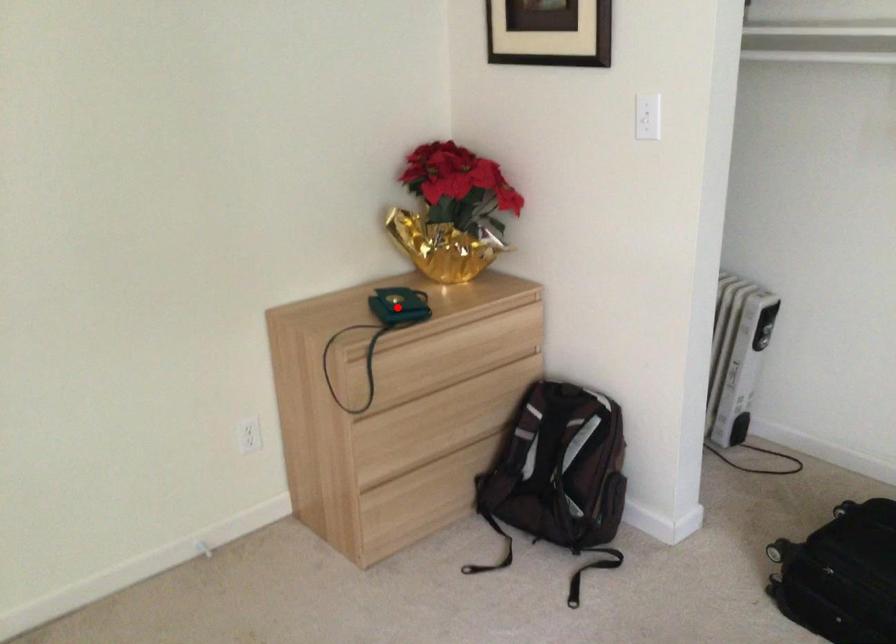
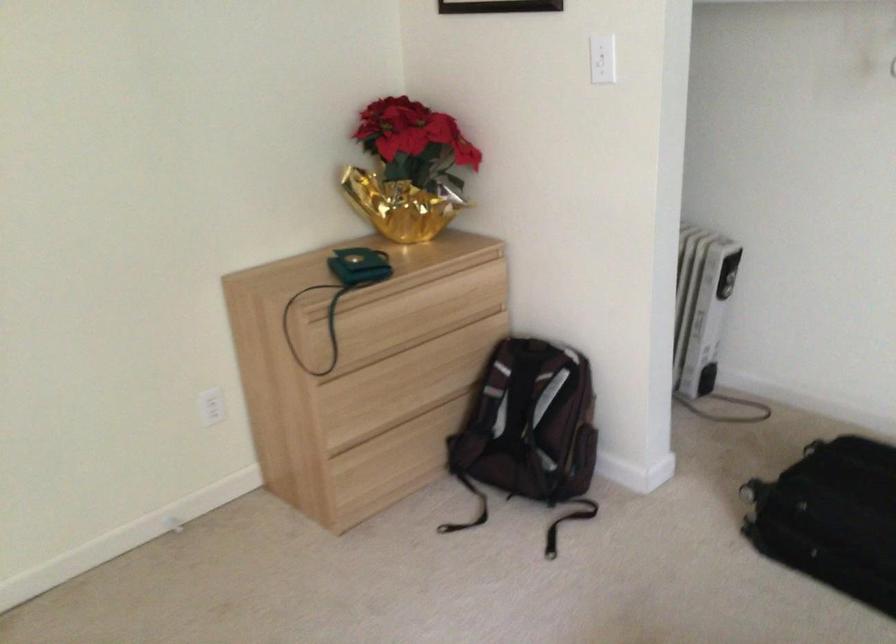
In the second image, find the point that corresponds to the highlighted location in the first image.

(358, 267)